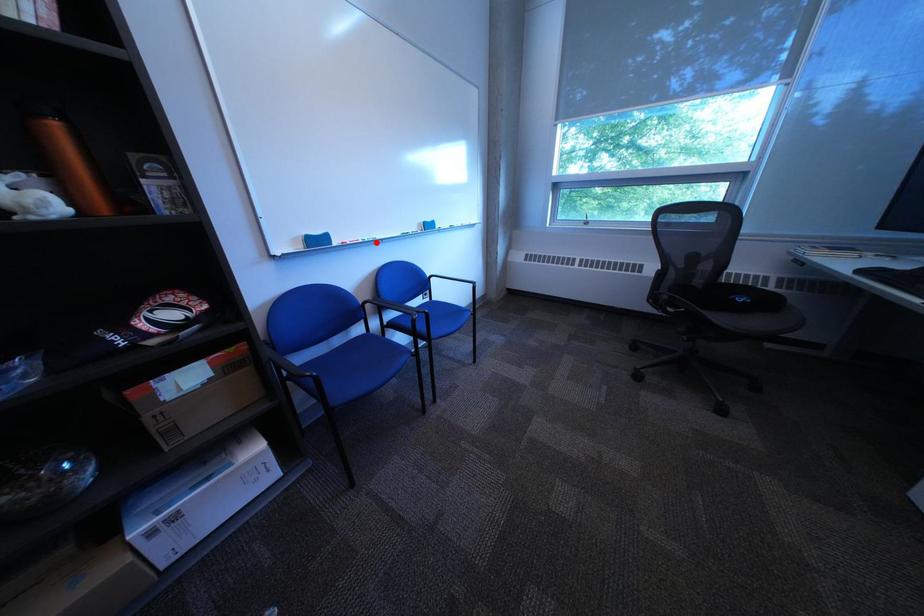
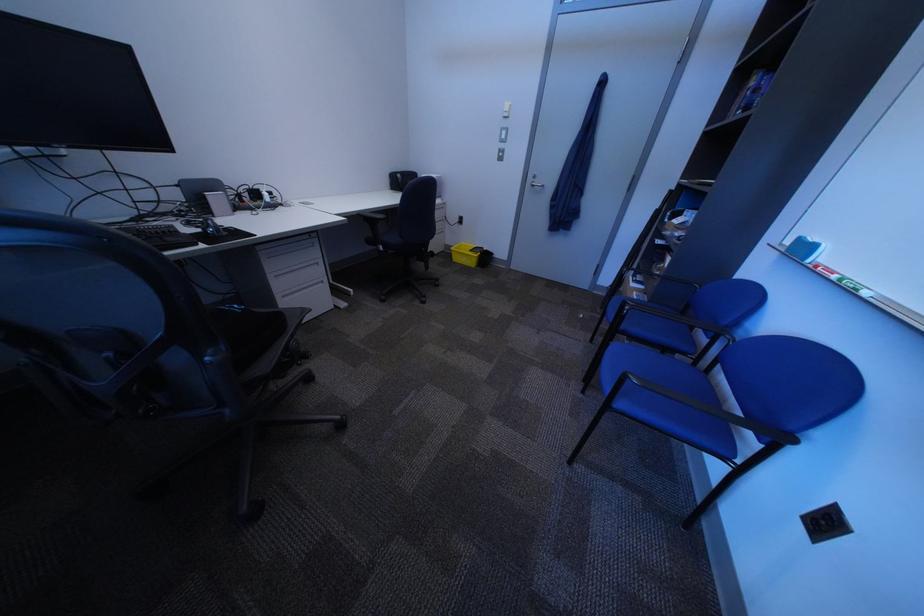
Find the pixel in the second image that matches the highlighted location in the first image.

(849, 278)